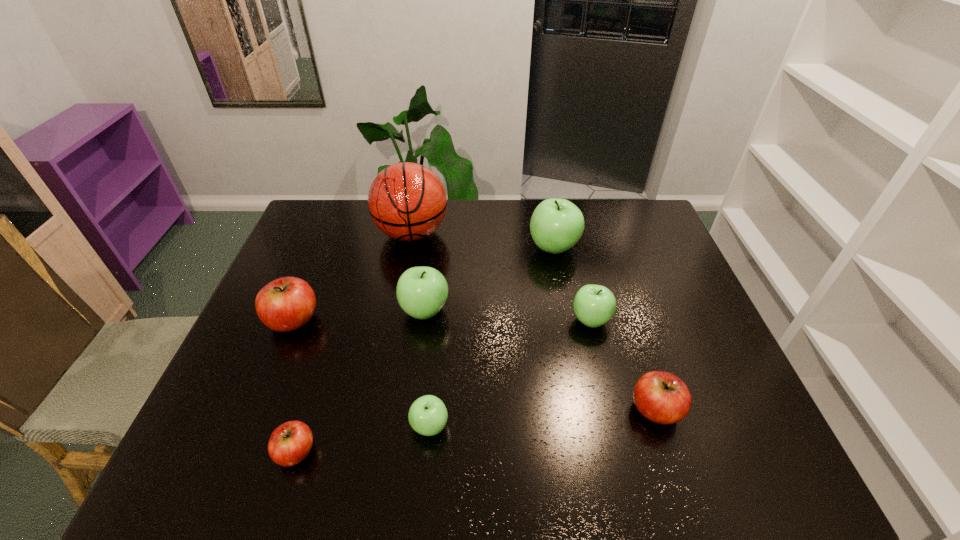
Identify the location of free spot that satisfies the following two spatial constraints: 1. on the back side of the nearest green apple; 2. on the left side of the rightmost red apple. The height and width of the screenshot is (540, 960). 431,410.